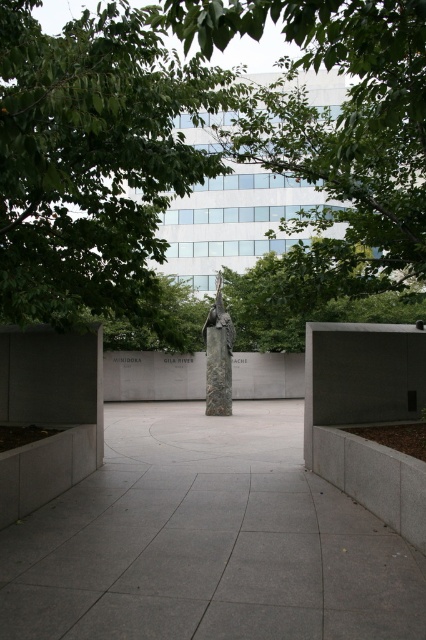
Between gray concrete pavement at center and rustic stone sculpture at center, which one has more height?

With more height is rustic stone sculpture at center.

How distant is gray concrete pavement at center from rustic stone sculpture at center?

gray concrete pavement at center and rustic stone sculpture at center are 8.44 meters apart from each other.

Is point (356, 572) positioned behind point (212, 326)?

No, (356, 572) is closer to viewer.

The height and width of the screenshot is (640, 426). I want to click on gray concrete pavement at center, so click(207, 540).

Can you confirm if green leafy tree at center is positioned to the left of gray concrete pavement at center?

Correct, you'll find green leafy tree at center to the left of gray concrete pavement at center.

Is green leafy tree at center shorter than gray concrete pavement at center?

In fact, green leafy tree at center may be taller than gray concrete pavement at center.

Does point (106, 198) come behind point (181, 616)?

Yes, point (106, 198) is behind point (181, 616).

Locate an element on the screen. The image size is (426, 640). green leafy tree at center is located at coordinates (206, 161).

Which is below, green leafy tree at center or rustic stone sculpture at center?

Positioned lower is rustic stone sculpture at center.

Image resolution: width=426 pixels, height=640 pixels. What do you see at coordinates (206, 161) in the screenshot?
I see `green leafy tree at center` at bounding box center [206, 161].

Between point (247, 282) and point (230, 410), which one is positioned behind?

The point (247, 282) is more distant.

Image resolution: width=426 pixels, height=640 pixels. In order to click on green leafy tree at center in this screenshot , I will do `click(206, 161)`.